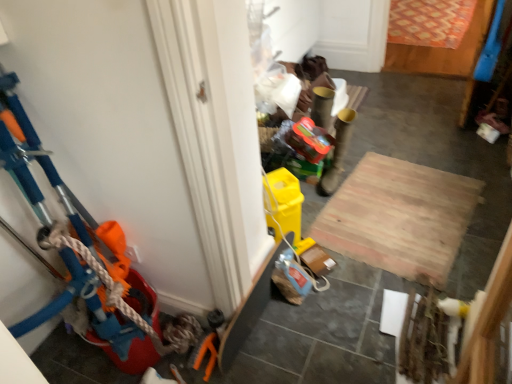
Question: Is matte plastic bucket at left further to the viewer compared to wooden at center?

Choices:
 (A) no
 (B) yes

Answer: (A)

Question: From a real-world perspective, is matte plastic bucket at left beneath wooden at center?

Choices:
 (A) yes
 (B) no

Answer: (B)

Question: From the image's perspective, would you say matte plastic bucket at left is positioned over wooden at center?

Choices:
 (A) yes
 (B) no

Answer: (A)

Question: Is matte plastic bucket at left in front of wooden at center?

Choices:
 (A) yes
 (B) no

Answer: (A)

Question: Can you confirm if matte plastic bucket at left is wider than wooden at center?

Choices:
 (A) yes
 (B) no

Answer: (B)

Question: Is matte plastic bucket at left facing towards wooden at center?

Choices:
 (A) no
 (B) yes

Answer: (A)

Question: Does wooden at center come behind matte plastic bucket at left?

Choices:
 (A) yes
 (B) no

Answer: (A)

Question: Is wooden at center to the right of matte plastic bucket at left from the viewer's perspective?

Choices:
 (A) yes
 (B) no

Answer: (A)

Question: Can you confirm if wooden at center is smaller than matte plastic bucket at left?

Choices:
 (A) no
 (B) yes

Answer: (B)

Question: Considering the relative positions of wooden at center and matte plastic bucket at left in the image provided, is wooden at center to the left of matte plastic bucket at left from the viewer's perspective?

Choices:
 (A) no
 (B) yes

Answer: (A)

Question: Is wooden at center next to matte plastic bucket at left?

Choices:
 (A) no
 (B) yes

Answer: (A)

Question: Could matte plastic bucket at left be considered to be inside wooden at center?

Choices:
 (A) yes
 (B) no

Answer: (B)

Question: From a real-world perspective, relative to matte plastic bucket at left, is wooden at center vertically above or below?

Choices:
 (A) below
 (B) above

Answer: (A)